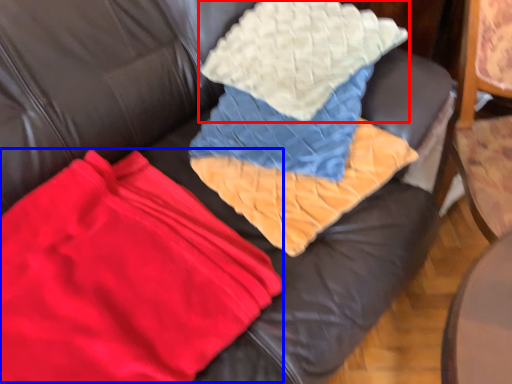
Question: Among these objects, which one is nearest to the camera, throw pillow (highlighted by a red box) or fabric (highlighted by a blue box)?

Choices:
 (A) throw pillow
 (B) fabric

Answer: (B)